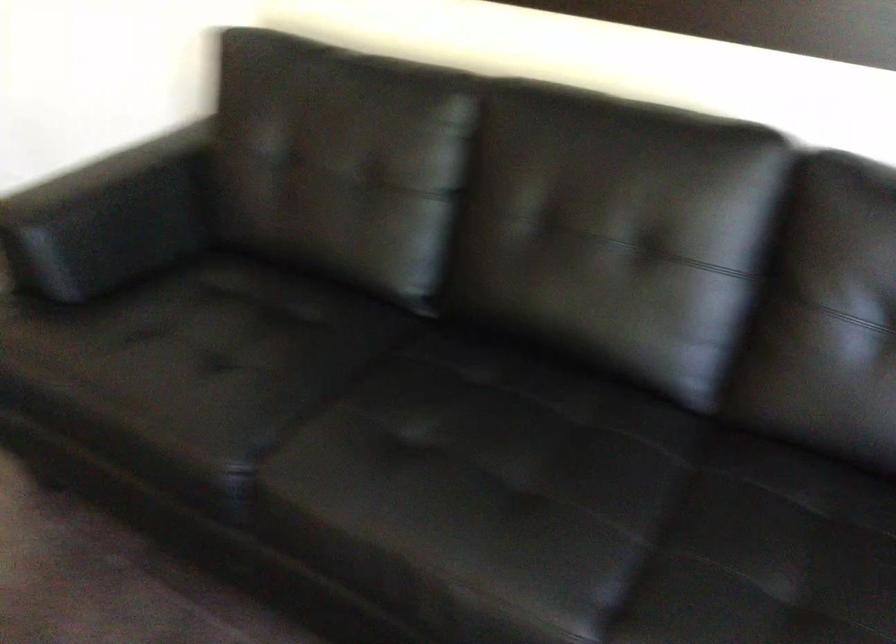
Find the location of a particular element. The height and width of the screenshot is (644, 896). black sofa armrest is located at coordinates (108, 218).